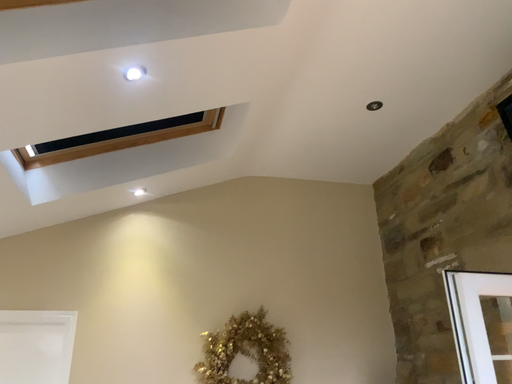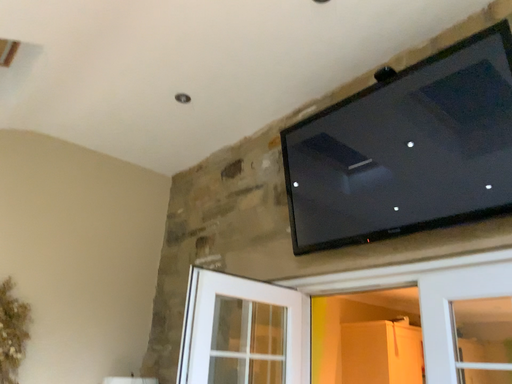
Question: Which way did the camera rotate in the video?

Choices:
 (A) rotated left
 (B) rotated right

Answer: (B)